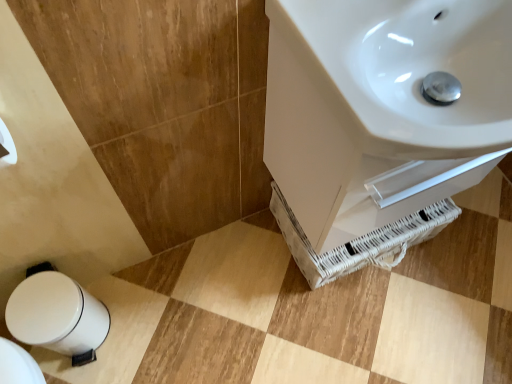
Where is `free space above white glossy trash can at lower left (from a real-world perspective)`? free space above white glossy trash can at lower left (from a real-world perspective) is located at coordinates (41, 307).